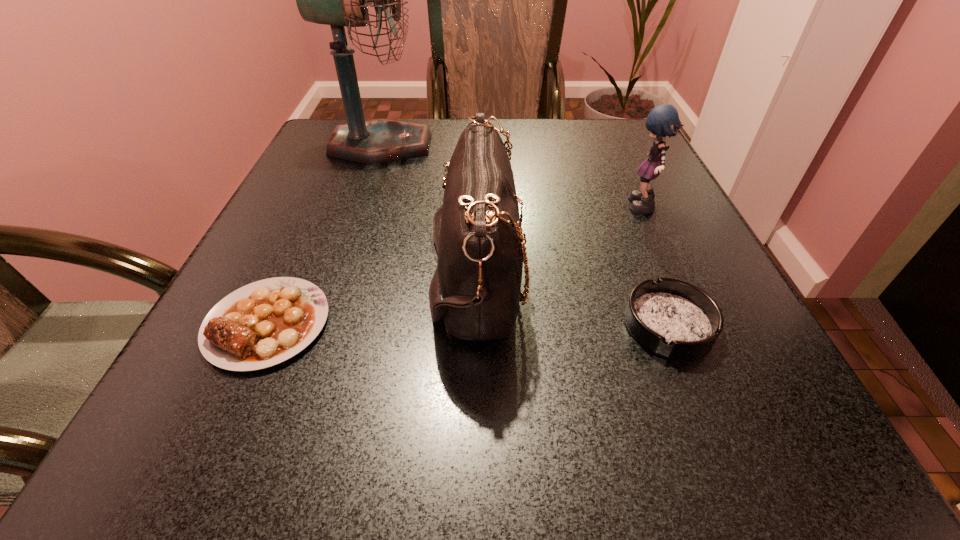
You are a GUI agent. You are given a task and a screenshot of the screen. Output one action in this format:
    pyautogui.click(x=<x>, y=<y>)
    Task: Click on the fan
    
    Given the screenshot: What is the action you would take?
    pyautogui.click(x=338, y=0)

This screenshot has width=960, height=540. In order to click on the tallest object in this screenshot , I will do `click(338, 0)`.

Find the location of `the third object from right to left`. the third object from right to left is located at coordinates (477, 231).

I want to click on rag doll, so click(663, 120).

This screenshot has width=960, height=540. I want to click on ashtray, so click(x=676, y=319).

This screenshot has height=540, width=960. Find the location of `steak`. steak is located at coordinates (264, 323).

Identify the location of vacant space located 0.300m in front of the farthest object where the wind blows. (547, 145).

The width and height of the screenshot is (960, 540). I want to click on vacant point located at the front of the handbag with chain and zipper, so [686, 275].

Find the location of a particular element. This screenshot has height=540, width=960. vacant space situated on the front-facing side of the rag doll is located at coordinates (564, 209).

Image resolution: width=960 pixels, height=540 pixels. Find the location of `free region located on the front-facing side of the rag doll`. free region located on the front-facing side of the rag doll is located at coordinates coord(532,209).